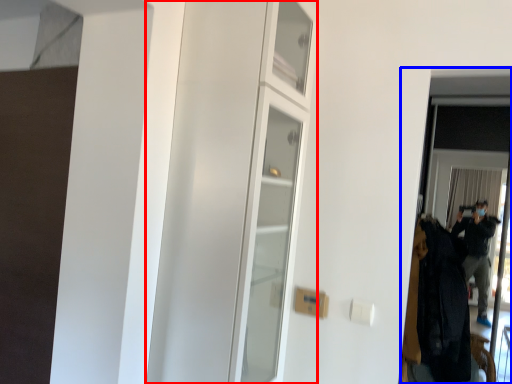
Question: Which of the following is the closest to the observer, dresser (highlighted by a red box) or screen door (highlighted by a blue box)?

Choices:
 (A) dresser
 (B) screen door

Answer: (A)